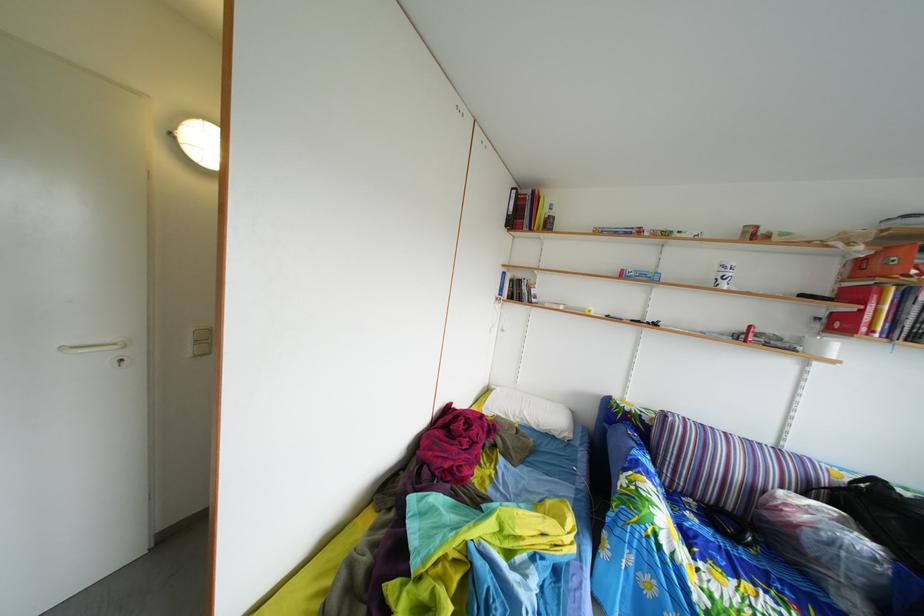
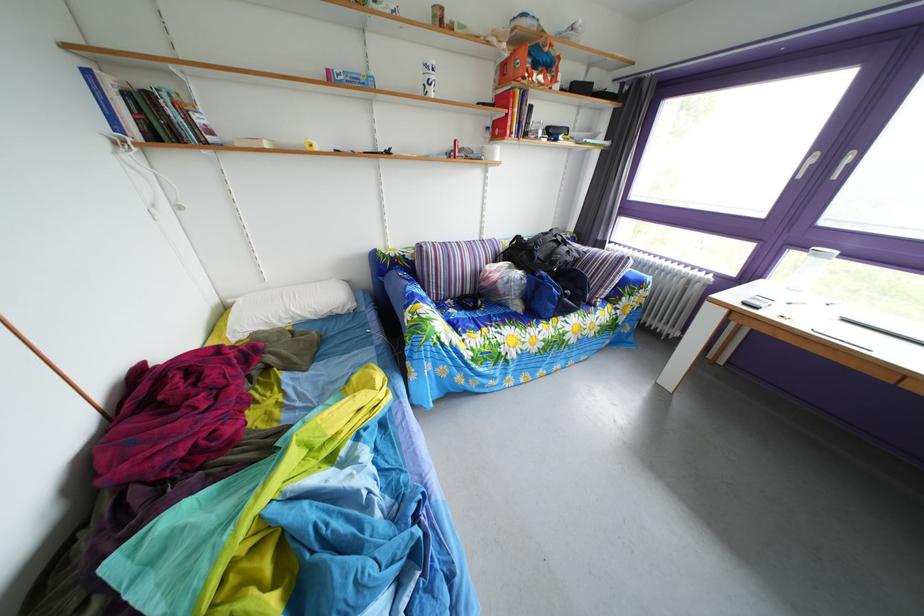
The point at (886,515) is marked in the first image. Where is the corresponding point in the second image?

(529, 261)